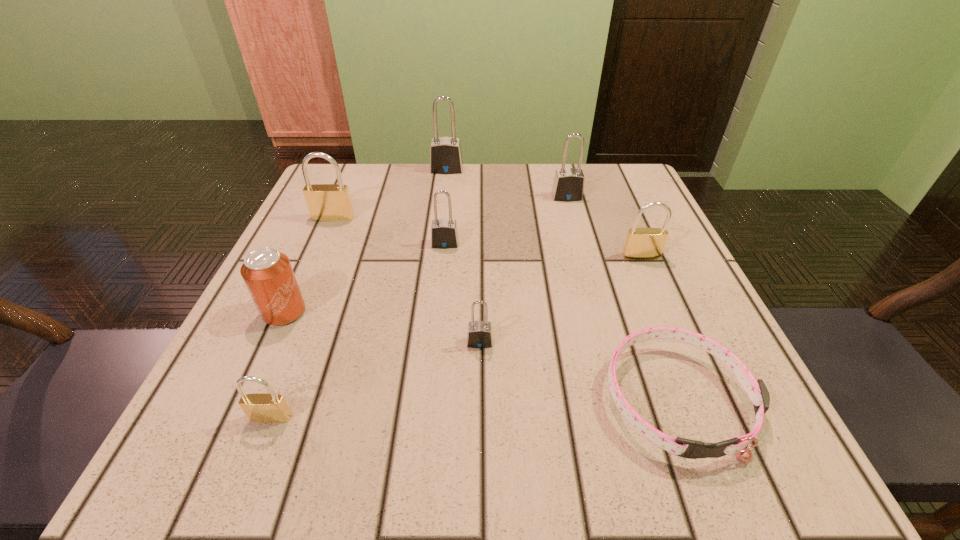
Find the location of a particular element. free space located on the front-facing side of the biggest brass padlock is located at coordinates (264, 377).

Find the location of `vacant region located 0.350m on the shackle of the fourth farthest padlock`. vacant region located 0.350m on the shackle of the fourth farthest padlock is located at coordinates (429, 410).

Find the location of a particular element. The image size is (960, 540). blank space located 0.180m on the front-facing side of the fifth farthest padlock is located at coordinates (674, 333).

Identify the location of free spot located on the front of the can. The width and height of the screenshot is (960, 540). (216, 463).

Find the location of a particular element. This screenshot has height=540, width=960. vacant space situated on the shackle of the third padlock from right to left is located at coordinates (480, 427).

Identify the location of padlock at the near edge. (262, 407).

The height and width of the screenshot is (540, 960). In order to click on dog collar that is at the near edge in this screenshot , I will do `click(756, 390)`.

Where is `can situated at the left edge`? can situated at the left edge is located at coordinates (268, 274).

Identify the location of dog collar that is at the right edge. The image size is (960, 540). (756, 390).

What are the coordinates of `object located at the far left corner` in the screenshot? It's located at (326, 202).